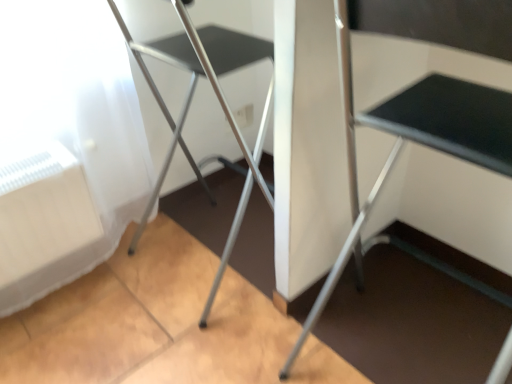
The width and height of the screenshot is (512, 384). Find the location of `free point in front of metallic silver chair at left`. free point in front of metallic silver chair at left is located at coordinates (183, 340).